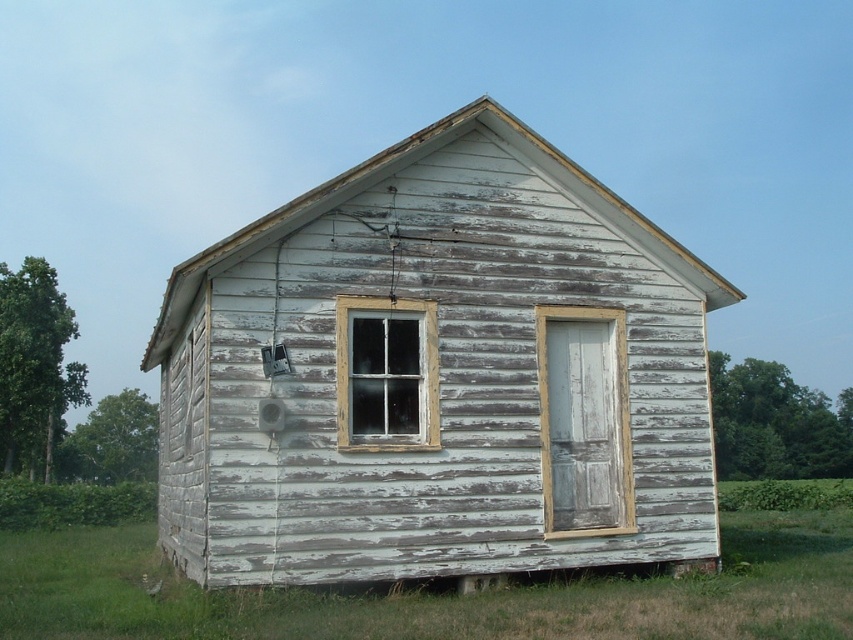
You are a painter assessing the white weathered wood hut at center and the white weathered wood at lower right for restoration. Which object requires a ladder to work on due to its height?

The white weathered wood hut at center requires a ladder because it is much taller than the white weathered wood at lower right.

You are standing in the grassy field in front of the white weathered wood hut at center and the clear glass window at center. Which object is closer to you?

The white weathered wood hut at center is closer to the viewer than the clear glass window at center.

You are standing at point (669, 596) and want to walk towards the building. Is point (590, 180) behind you or in front of you relative to the building?

Point (590, 180) is behind point (669, 596), so it would be behind you relative to the building.